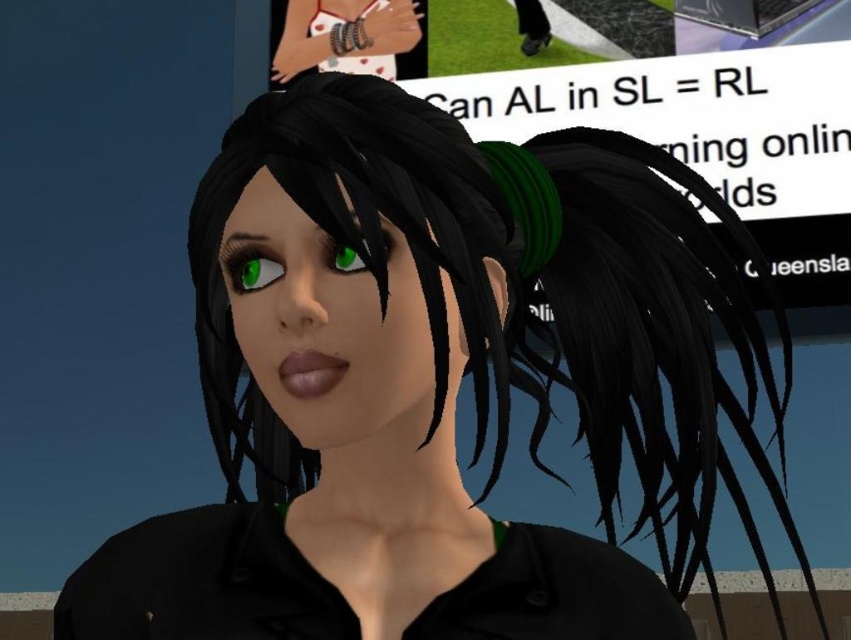
Question: Does green matte eye at upper left come in front of green matte eye at center?

Choices:
 (A) yes
 (B) no

Answer: (B)

Question: Can you confirm if green rubber hairband at right is smaller than green matte eye at upper left?

Choices:
 (A) no
 (B) yes

Answer: (A)

Question: Estimate the real-world distances between objects in this image. Which object is closer to the green matte eye at center?

Choices:
 (A) green matte eye at upper left
 (B) green rubber hairband at right

Answer: (A)

Question: Estimate the real-world distances between objects in this image. Which object is farther from the green matte eye at center?

Choices:
 (A) green matte eye at upper left
 (B) green rubber hairband at right

Answer: (B)

Question: Can you confirm if green matte eye at upper left is positioned to the right of green matte eye at center?

Choices:
 (A) yes
 (B) no

Answer: (B)

Question: Which is nearer to the green matte eye at upper left?

Choices:
 (A) green matte eye at center
 (B) green rubber hairband at right

Answer: (A)